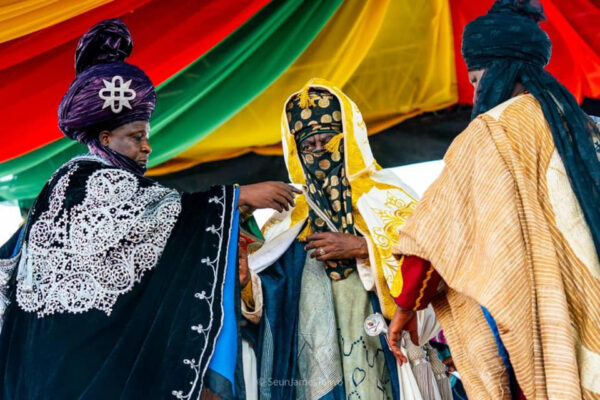
What are the coordinates of `fabric` in the screenshot? It's located at (180, 19), (372, 42), (588, 46), (40, 30).